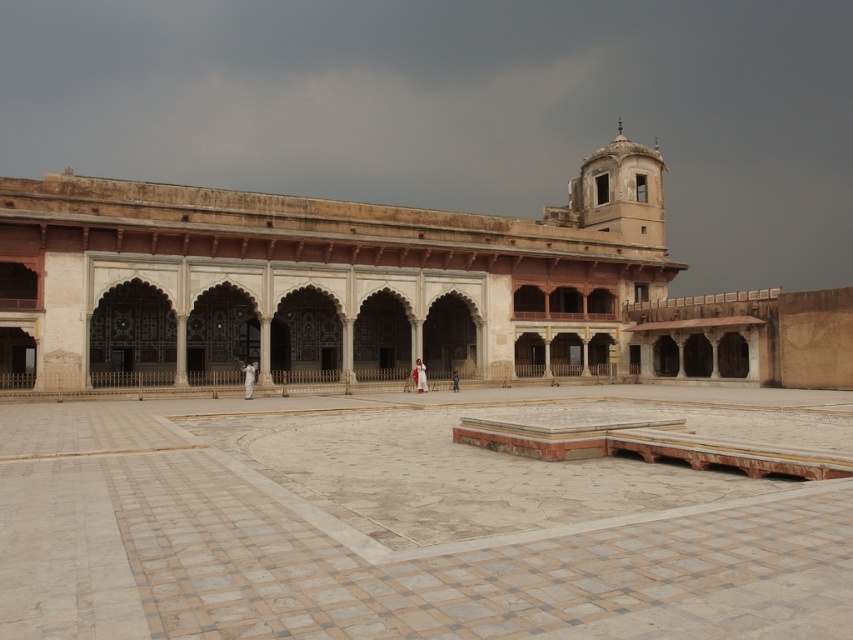
You are an architect designing a new garden layout. You need to place a statue that requires a space wider than the white marble courtyard at center. Can the beige stone palace at center accommodate the statue?

The white marble courtyard at center is narrower than the beige stone palace at center, so the statue requiring a wider space can be placed at the beige stone palace at center.

You are standing in the courtyard of the historical building and want to reach the point marked at coordinates point [218,461]. The path is clear except for a 100 feet long barrier starting from your current position. Can you walk around the barrier to reach the point?

The distance between you and point [218,461] is 105.57 feet. Since the barrier is only 100 feet long, you can walk around the barrier to reach the point as the total distance required is longer than the barrier itself.